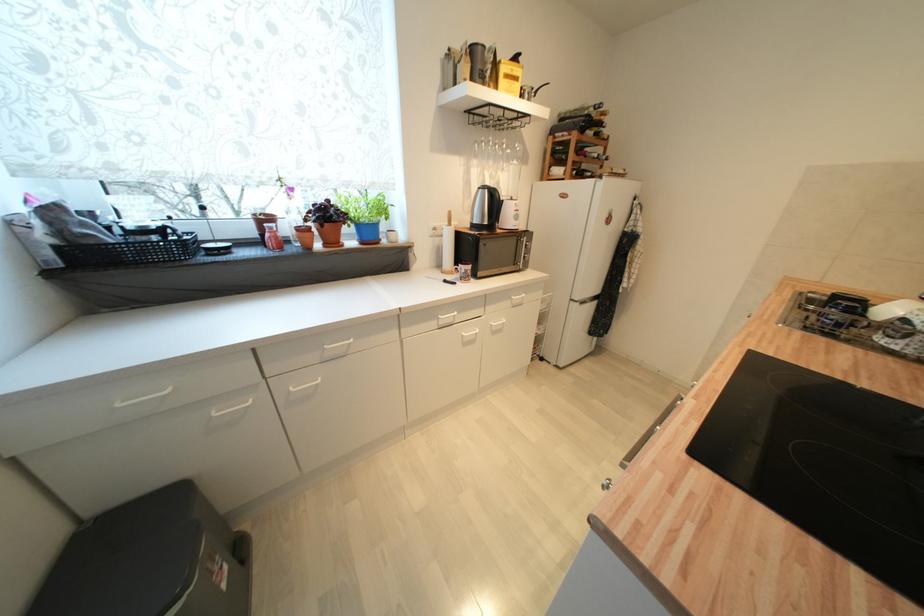
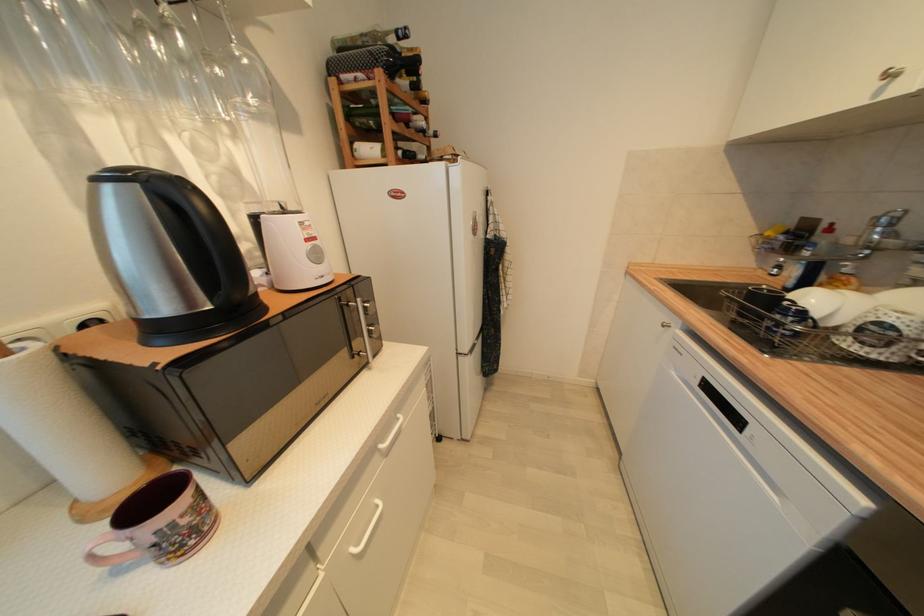
Question: The first image is from the beginning of the video and the second image is from the end. How did the camera likely rotate when shooting the video?

Choices:
 (A) Left
 (B) Right
 (C) Up
 (D) Down

Answer: (B)